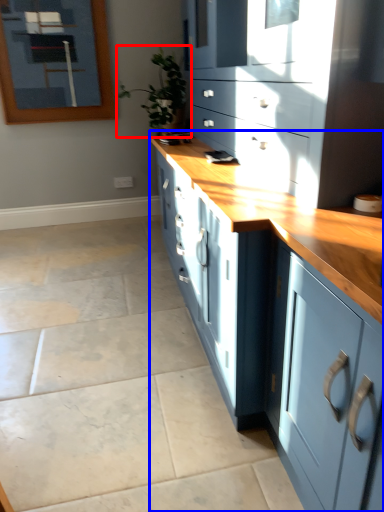
Question: Which of the following is the farthest to the observer, houseplant (highlighted by a red box) or cabinetry (highlighted by a blue box)?

Choices:
 (A) houseplant
 (B) cabinetry

Answer: (A)